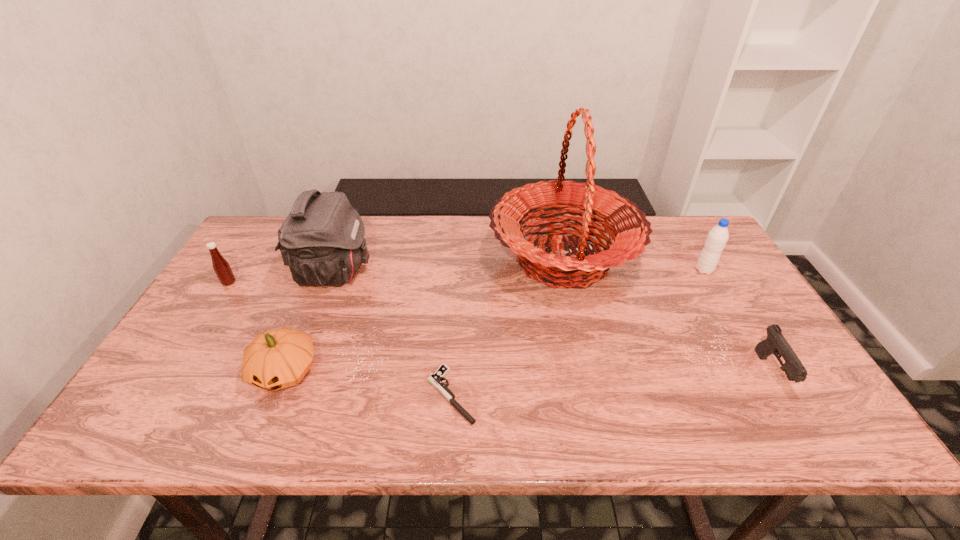
Locate an element on the screen. free space between the fifth shortest object and the shoulder bag is located at coordinates (519, 271).

Find the location of a particular element. Image resolution: width=960 pixels, height=540 pixels. object that is the fourth closest one to the basket is located at coordinates (322, 241).

Image resolution: width=960 pixels, height=540 pixels. I want to click on object that can be found as the fifth closest to the fifth shortest object, so click(x=276, y=359).

You are a GUI agent. You are given a task and a screenshot of the screen. Output one action in this format:
    pyautogui.click(x=<x>, y=<y>)
    Task: Click on the free space that satisfies the following two spatial constraints: 1. on the open flap of the second tallest object; 2. on the side of the gourd with the carved face
    The width and height of the screenshot is (960, 540).
    Given the screenshot: What is the action you would take?
    pyautogui.click(x=296, y=372)